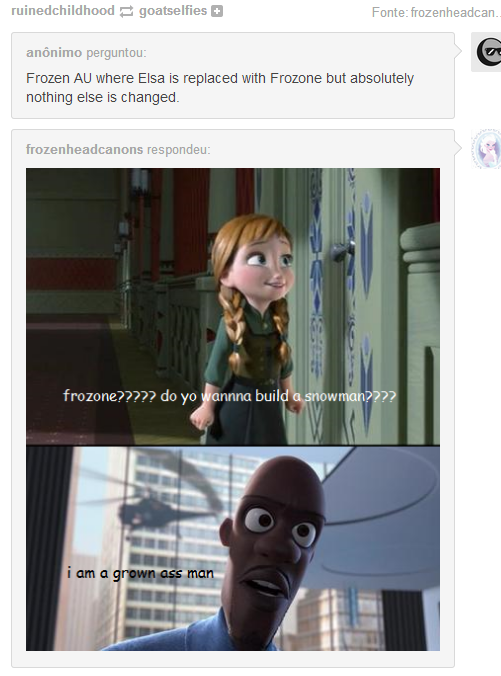
This screenshot has height=676, width=501. Find the location of `cover`. cover is located at coordinates (383, 504).